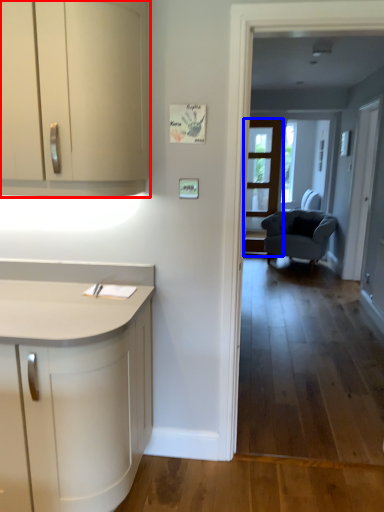
Question: Which object is further to the camera taking this photo, cabinetry (highlighted by a red box) or screen door (highlighted by a blue box)?

Choices:
 (A) cabinetry
 (B) screen door

Answer: (B)